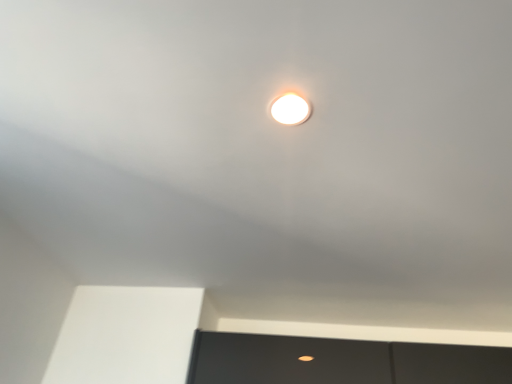
Describe the element at coordinates (290, 109) in the screenshot. The image size is (512, 384). I see `white glossy light at center` at that location.

You are a GUI agent. You are given a task and a screenshot of the screen. Output one action in this format:
    pyautogui.click(x=<x>, y=<y>)
    Task: Click on the white glossy light at center
    The image size is (512, 384).
    Given the screenshot: What is the action you would take?
    pyautogui.click(x=290, y=109)

This screenshot has width=512, height=384. I want to click on white glossy light at center, so click(290, 109).